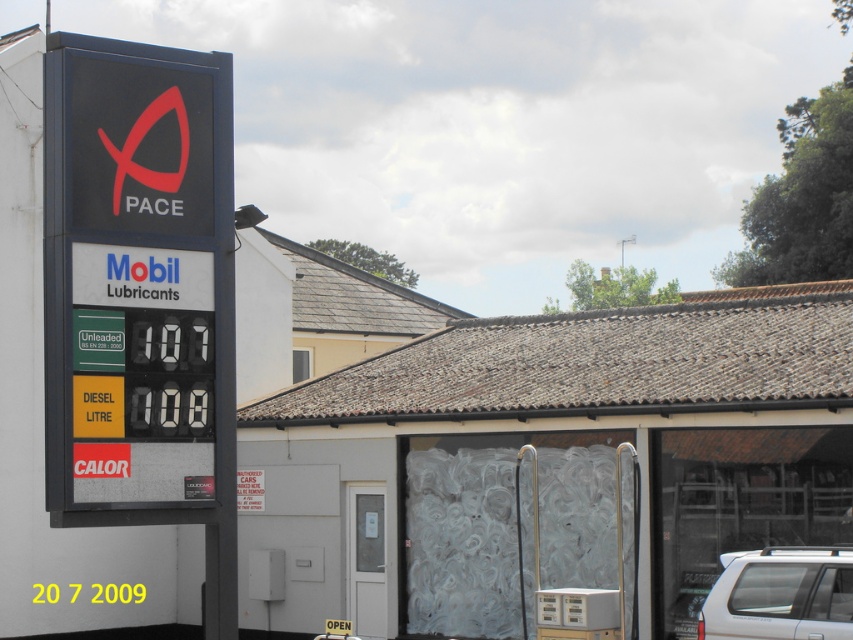
You are at the gas station and need to refuel your car. Your car is parked at the white matte suv at lower right. Which direction should you walk to reach the metallic silver fuel pump at center?

You should walk to the left from the white matte suv at lower right to reach the metallic silver fuel pump at center since the metallic silver fuel pump at center is to the right of the white matte suv at lower right.

Looking at this image, you are driving a car and want to fill up your tank at the gas station. You see the metallic silver fuel pump at center and the white matte suv at lower right. Which vehicle is closer to the fuel pump?

The metallic silver fuel pump at center is closer to the fuel pump because the white matte suv at lower right is behind it.